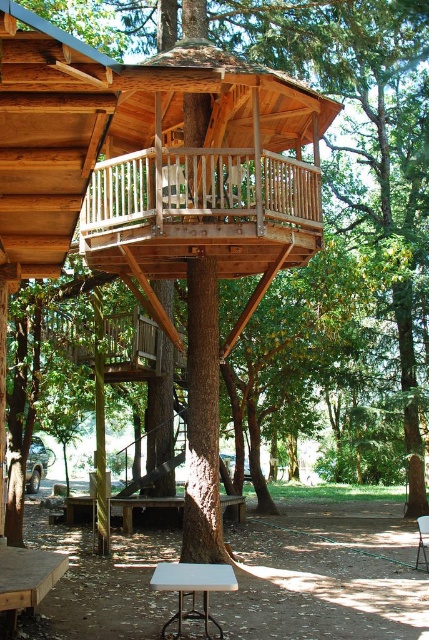
Is point (112, 499) positioned in front of point (165, 198)?

That is False.

The image size is (429, 640). What do you see at coordinates (142, 506) in the screenshot? I see `wooden picnic table at center` at bounding box center [142, 506].

Is point (236, 512) behind point (183, 177)?

Yes, it is behind point (183, 177).

I want to click on wooden picnic table at center, so click(x=142, y=506).

Is white plastic picnic table at lower left wider than white plastic picnic table at lower center?

Indeed, white plastic picnic table at lower left has a greater width compared to white plastic picnic table at lower center.

Who is positioned more to the left, white plastic picnic table at lower left or white plastic picnic table at lower center?

Positioned to the left is white plastic picnic table at lower left.

What do you see at coordinates (27, 579) in the screenshot? I see `white plastic picnic table at lower left` at bounding box center [27, 579].

I want to click on white plastic picnic table at lower left, so click(27, 579).

Consider the image. Can you confirm if white plastic picnic table at lower left is positioned to the left of metallic folding chair at center?

Yes, white plastic picnic table at lower left is to the left of metallic folding chair at center.

Is white plastic picnic table at lower left positioned before metallic folding chair at center?

Yes.

Who is more distant from viewer, (39,573) or (422,516)?

The point (422,516) is more distant.

The height and width of the screenshot is (640, 429). What are the coordinates of `white plastic picnic table at lower left` in the screenshot? It's located at (27, 579).